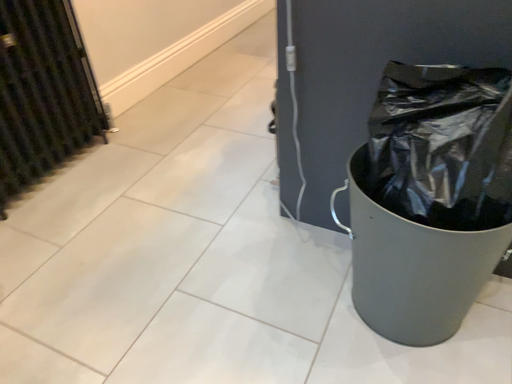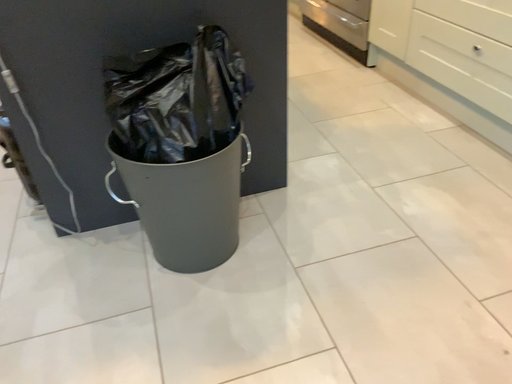
Question: Which way did the camera rotate in the video?

Choices:
 (A) rotated upward
 (B) rotated downward

Answer: (A)